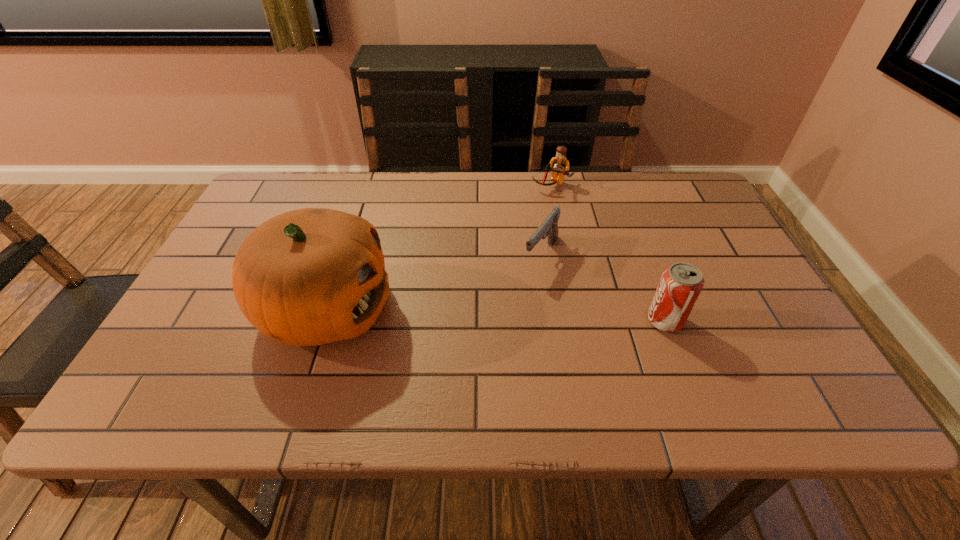
At what (x,y) coordinates should I click in order to perform the action: click on vacant space situated 0.140m holding a crossbow in the hands of the Lego. Please return your answer as a coordinate pair (x, y). Looking at the image, I should click on (532, 220).

Locate an element on the screen. The width and height of the screenshot is (960, 540). free location located 0.110m at the barrel of the pistol is located at coordinates (512, 303).

I want to click on blank space located 0.290m at the barrel of the pistol, so click(470, 359).

Locate an element on the screen. This screenshot has width=960, height=540. free location located 0.290m at the barrel of the pistol is located at coordinates (470, 359).

This screenshot has width=960, height=540. In order to click on object positioned at the far edge in this screenshot , I will do `click(560, 165)`.

I want to click on object that is at the near edge, so click(307, 277).

The width and height of the screenshot is (960, 540). In order to click on object that is positioned at the left edge in this screenshot , I will do `click(307, 277)`.

Locate an element on the screen. object that is positioned at the near left corner is located at coordinates (307, 277).

Identify the location of blank space at the far edge. (323, 192).

In the image, there is a desktop. Identify the location of blank space at the near edge. (356, 366).